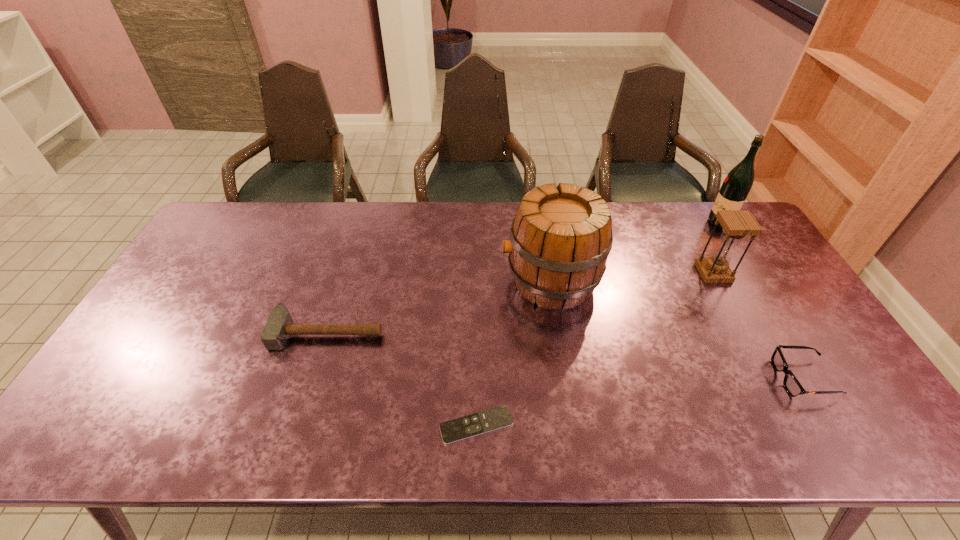
Where is `liquor`? The width and height of the screenshot is (960, 540). liquor is located at coordinates (739, 181).

Where is `the tallest object`? the tallest object is located at coordinates pyautogui.click(x=739, y=181).

Image resolution: width=960 pixels, height=540 pixels. In order to click on the fifth shortest object in this screenshot , I will do `click(560, 239)`.

At what (x,y) coordinates should I click in order to perform the action: click on hourglass. Please return your answer as a coordinate pair (x, y). Looking at the image, I should click on (737, 224).

Identify the location of the leftmost object. The image size is (960, 540). [x=280, y=325].

The width and height of the screenshot is (960, 540). In order to click on sunglasses in this screenshot , I will do (793, 387).

This screenshot has height=540, width=960. I want to click on the shortest object, so click(x=465, y=427).

You are a GUI agent. You are given a task and a screenshot of the screen. Output one action in this format:
    pyautogui.click(x=<x>, y=<y>)
    Task: Click on the remote control
    
    Given the screenshot: What is the action you would take?
    pyautogui.click(x=465, y=427)

At what (x,y) coordinates should I click in order to perform the action: click on vacant space located on the front-facing side of the liquor. Please return your answer as a coordinate pair (x, y). This screenshot has height=540, width=960. Looking at the image, I should click on (666, 222).

You are a GUI agent. You are given a task and a screenshot of the screen. Output one action in this format:
    pyautogui.click(x=<x>, y=<y>)
    Task: Click on the vacant space situated on the front-facing side of the liquor
    
    Given the screenshot: What is the action you would take?
    pyautogui.click(x=635, y=222)